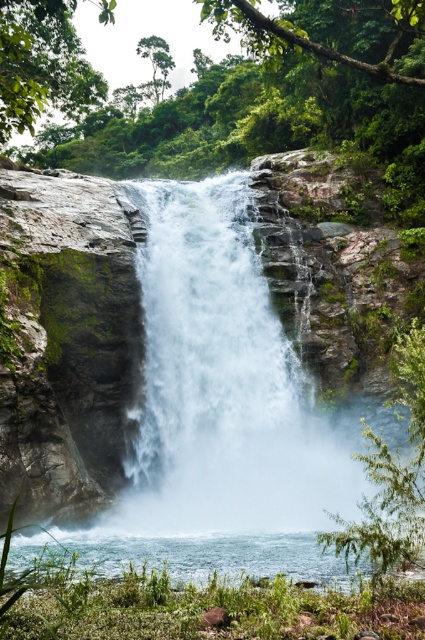
You are a photographer planning to capture the waterfall scene. You want to highlight both the white misty water at center and the clear water at lower center. Which of these two water features should you focus on if you want to emphasize the larger one in your composition?

The white misty water at center is larger in size than the clear water at lower center, so focusing on the white misty water at center will emphasize the larger feature in your composition.

From the picture: You are standing at the edge of the waterfall and want to take a photo of both the white misty water at center and the clear water at lower center. Which one will appear larger in your photo?

The white misty water at center will appear larger in the photo because it is closer to the viewer than the clear water at lower center.

Based on the photo, you are standing at the base of the waterfall and want to reach the point marked as point (285, 445). If your maximum comfortable walking distance is 20 meters, can you comfortably walk to that point?

The point (285, 445) is 18.89 meters from the viewer, which is within your maximum comfortable walking distance of 20 meters. Yes, you can comfortably walk to that point.